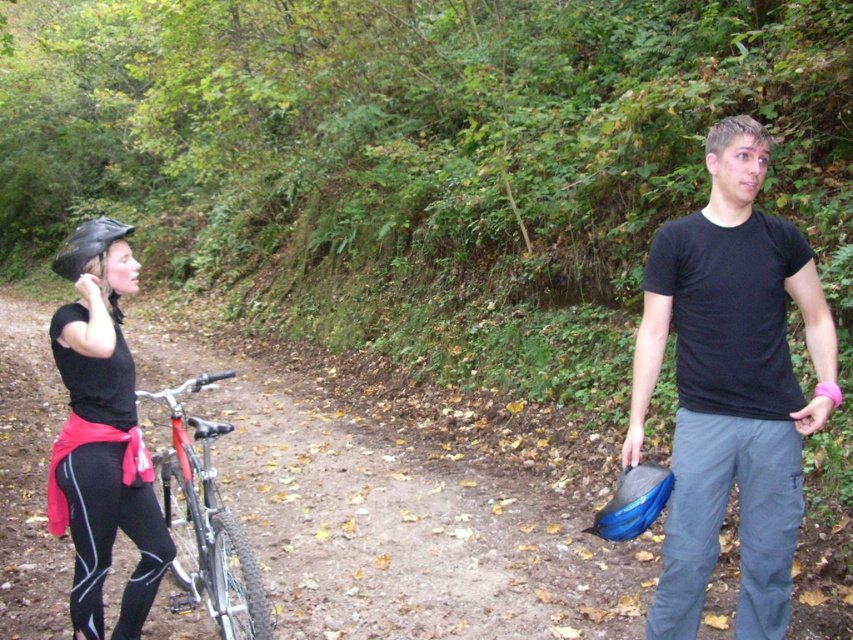
Question: Which point appears farthest from the camera in this image?

Choices:
 (A) (84, 500)
 (B) (169, 524)

Answer: (B)

Question: Which point is farther from the camera taking this photo?

Choices:
 (A) (798, 273)
 (B) (54, 522)

Answer: (B)

Question: Does black matte t-shirt at right appear on the left side of matte black helmet at left?

Choices:
 (A) no
 (B) yes

Answer: (A)

Question: Can you confirm if black matte t-shirt at right is wider than shiny metallic bicycle at left?

Choices:
 (A) no
 (B) yes

Answer: (A)

Question: Which object is closer to the camera taking this photo?

Choices:
 (A) matte black helmet at left
 (B) shiny metallic bicycle at left
 (C) black matte t-shirt at right

Answer: (C)

Question: Is matte black helmet at left wider than shiny metallic bicycle at left?

Choices:
 (A) no
 (B) yes

Answer: (A)